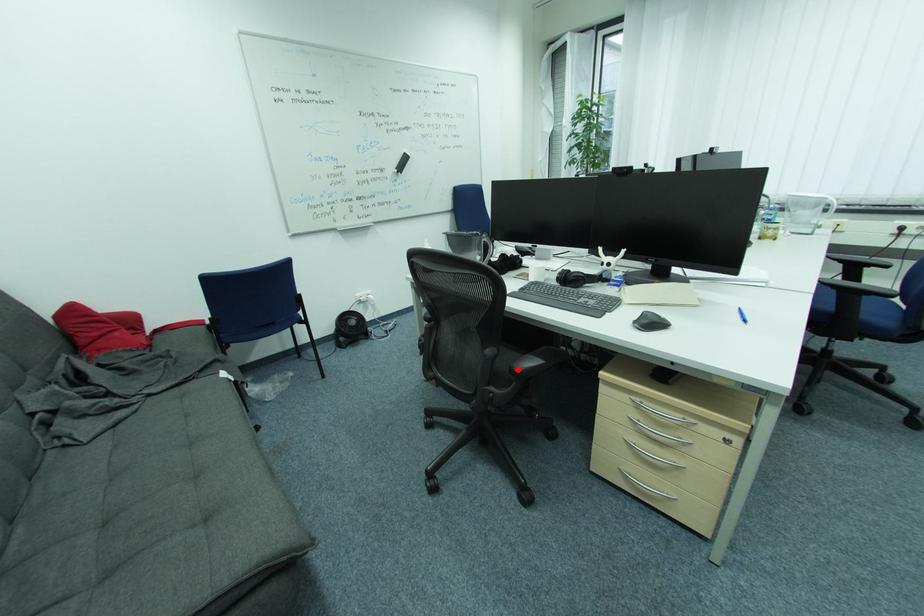
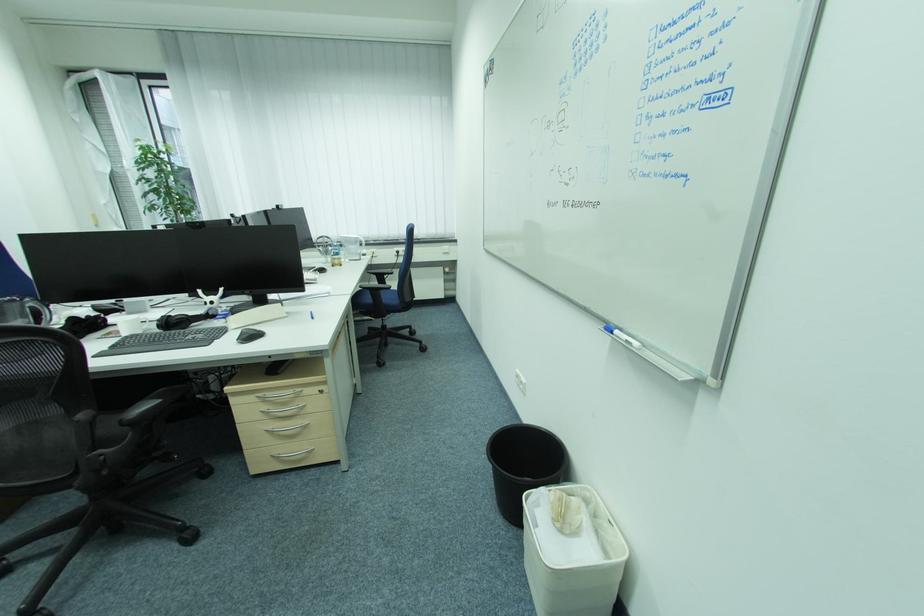
Where in the second image is the point corresponding to the highlighted location from the first image?

(128, 422)